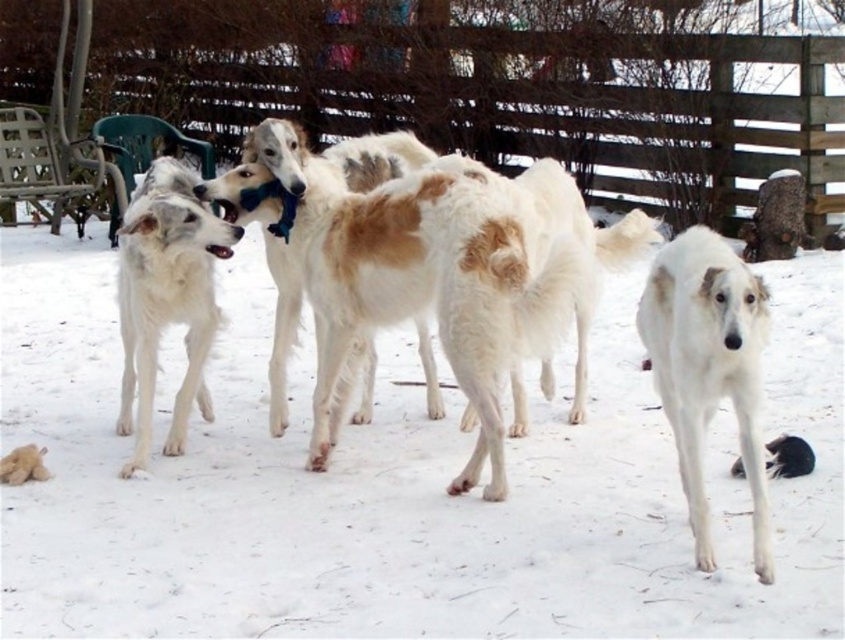
Who is positioned more to the right, wooden fence at upper center or white fluffy dog at lower right?

Positioned to the right is wooden fence at upper center.

Does point (562, 61) lie in front of point (753, 394)?

No, (562, 61) is further to viewer.

Which is behind, point (462, 141) or point (673, 372)?

Positioned behind is point (462, 141).

You are a GUI agent. You are given a task and a screenshot of the screen. Output one action in this format:
    pyautogui.click(x=<x>, y=<y>)
    Task: Click on the wooden fence at upper center
    
    Given the screenshot: What is the action you would take?
    (x=489, y=90)

Is point (175, 314) positioned before point (14, 449)?

Yes, point (175, 314) is closer to viewer.

Measure the distance between point (146,394) and camera.

The distance of point (146,394) from camera is 3.72 meters.

Is point (194, 225) farther from viewer compared to point (25, 477)?

That is False.

I want to click on white fur dog at left, so click(166, 296).

Looking at this image, can you confirm if white fluffy snow at center is positioned below white fluffy dog at lower right?

Yes.

Is point (35, 529) behind point (756, 356)?

Yes, it is.

Image resolution: width=845 pixels, height=640 pixels. Find the location of `white fluffy snow at center`. white fluffy snow at center is located at coordinates (396, 484).